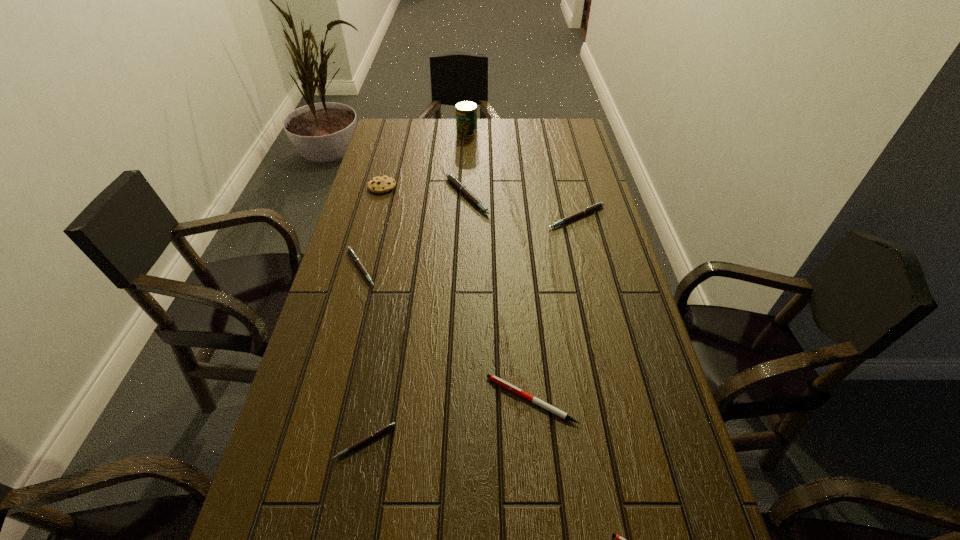
Find the location of a particular element. free space that is in between the brown cookie and the nearest pink pen is located at coordinates (374, 314).

At what (x,y) coordinates should I click in order to perform the action: click on vacant area that lies between the farther white pen and the rightmost pink pen. Please return your answer as a coordinate pair (x, y). Image resolution: width=960 pixels, height=540 pixels. Looking at the image, I should click on (554, 308).

Find the location of a particular element. Image resolution: width=960 pixels, height=540 pixels. free space between the second nearest pink pen and the nearest pink pen is located at coordinates (363, 354).

You are a GUI agent. You are given a task and a screenshot of the screen. Output one action in this format:
    pyautogui.click(x=<x>, y=<y>)
    Task: Click on the object that ranks as the second closest to the third tallest object
    The height and width of the screenshot is (540, 960).
    Given the screenshot: What is the action you would take?
    [598, 205]

You are a GUI agent. You are given a task and a screenshot of the screen. Output one action in this format:
    pyautogui.click(x=<x>, y=<y>)
    Task: Click on the object that stands as the fifth closest to the second nearest pink pen
    The width and height of the screenshot is (960, 540).
    Given the screenshot: What is the action you would take?
    pyautogui.click(x=598, y=205)

Identify the location of pen that stands as the closest to the biggest pink pen. This screenshot has height=540, width=960. (598, 205).

The height and width of the screenshot is (540, 960). In order to click on pen that is the fourth closest to the seventh shortest object in this screenshot , I will do `click(495, 379)`.

Where is `pink pen object that ranks as the second closest to the farther white pen`? This screenshot has height=540, width=960. pink pen object that ranks as the second closest to the farther white pen is located at coordinates click(x=350, y=250).

This screenshot has width=960, height=540. Identify the location of pink pen that is the fourth nearest to the nearest pen. (450, 177).

I want to click on white pen that is the nearest to the second tallest object, so click(495, 379).